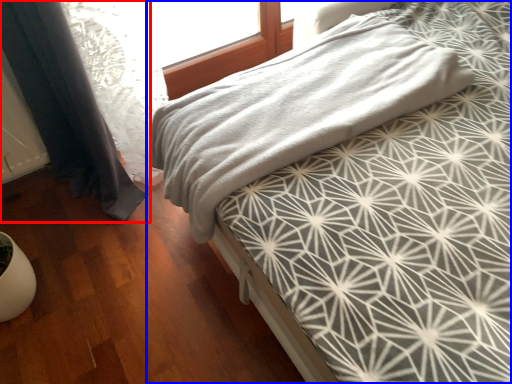
Question: Which object is further to the camera taking this photo, curtain (highlighted by a red box) or bed (highlighted by a blue box)?

Choices:
 (A) curtain
 (B) bed

Answer: (B)